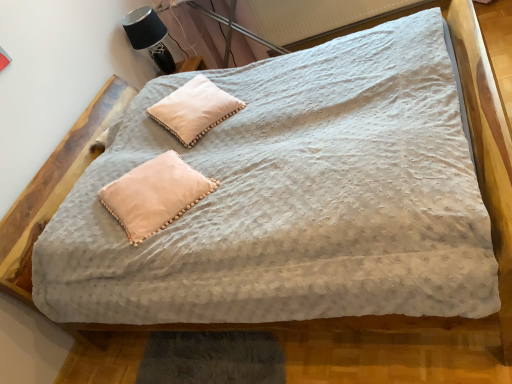
Question: From a real-world perspective, is white textured radiator at upper center above or below black fabric table lamp at upper left?

Choices:
 (A) below
 (B) above

Answer: (A)

Question: Considering the positions of white textured radiator at upper center and black fabric table lamp at upper left in the image, is white textured radiator at upper center wider or thinner than black fabric table lamp at upper left?

Choices:
 (A) wide
 (B) thin

Answer: (B)

Question: Considering the real-world distances, which object is farthest from the black fabric table lamp at upper left?

Choices:
 (A) white soft pillow at upper center, the second pillow positioned from the bottom
 (B) white textured radiator at upper center
 (C) pale pink fabric pillow at center, acting as the 1th pillow starting from the bottom

Answer: (C)

Question: Estimate the real-world distances between objects in this image. Which object is closer to the black fabric table lamp at upper left?

Choices:
 (A) white textured radiator at upper center
 (B) white soft pillow at upper center, arranged as the 1th pillow when viewed from the back
 (C) pale pink fabric pillow at center, positioned as the second pillow in back-to-front order

Answer: (B)